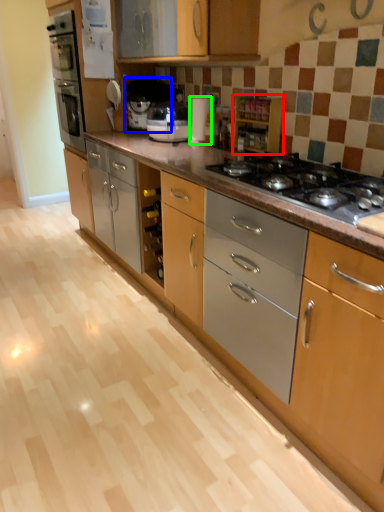
Question: Estimate the real-world distances between objects in this image. Which object is farther from cabinetry (highlighted by a red box), coffee machine (highlighted by a blue box) or appliance (highlighted by a green box)?

Choices:
 (A) coffee machine
 (B) appliance

Answer: (A)